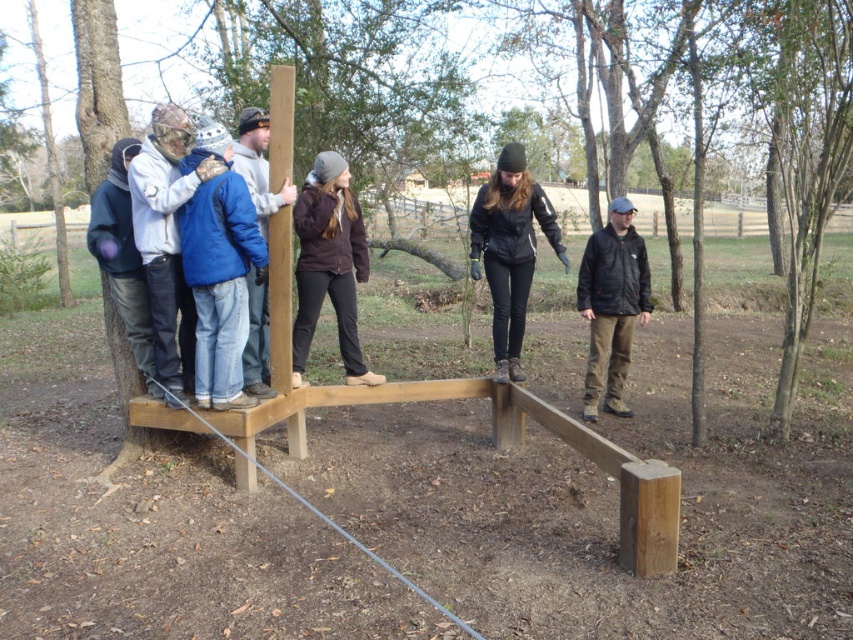
Looking at this image, you are a photographer positioned at the origin point in the park scene. You want to capture a photo of the blue denim jacket at left. According to the coordinates provided, in which direction should you move your camera to frame the jacket properly?

The blue denim jacket at left is located at coordinates point (219, 268). Since the origin is at the center, you should move your camera to the right and slightly upwards to frame the jacket properly.

You are a photographer trying to capture a photo of the camouflage fabric jacket at left and the brown fuzzy jacket at center. Which jacket should you focus on first if you want to include both in your frame without moving the camera?

The camouflage fabric jacket at left is taller than the brown fuzzy jacket at center, so you should focus on the camouflage fabric jacket at left first to ensure it fits within the frame.